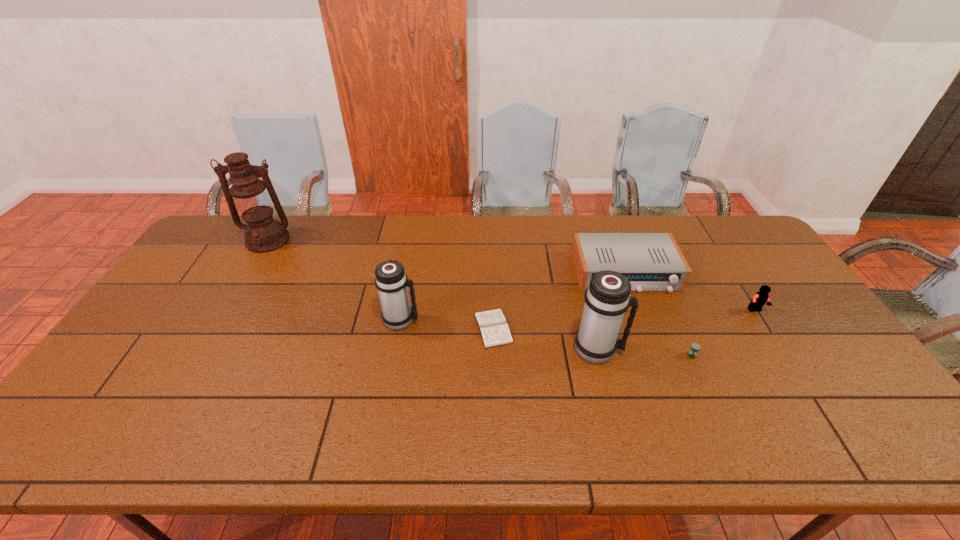
Identify the location of the sixth tallest object. (694, 349).

This screenshot has height=540, width=960. In order to click on vacant space located on the side with the handle of the shorter thermos bottle in this screenshot , I will do `click(475, 321)`.

The image size is (960, 540). In order to click on free space located 0.290m on the side with the handle of the nearer thermos bottle in this screenshot , I will do `click(730, 350)`.

Where is `free space located 0.300m on the front-facing side of the rightmost object`? The height and width of the screenshot is (540, 960). free space located 0.300m on the front-facing side of the rightmost object is located at coordinates (817, 407).

What are the coordinates of `free location located on the right of the leftmost object` in the screenshot? It's located at (377, 240).

The height and width of the screenshot is (540, 960). In order to click on vacant region located 0.270m on the right of the fifth object from right to left in this screenshot , I will do `click(609, 328)`.

In order to click on vacant space located on the control panel of the fifth tallest object in this screenshot , I will do `click(666, 384)`.

Identify the location of vacant area situated 0.280m on the right of the sixth tallest object. This screenshot has width=960, height=540. (807, 355).

You are a GUI agent. You are given a task and a screenshot of the screen. Output one action in this format:
    pyautogui.click(x=<x>, y=<y>)
    Task: Click on the oil lamp that is positioned at the far edge
    The image size is (960, 540).
    Given the screenshot: What is the action you would take?
    click(x=248, y=195)

Where is `radio receiver present at the far edge`? This screenshot has height=540, width=960. radio receiver present at the far edge is located at coordinates (651, 261).